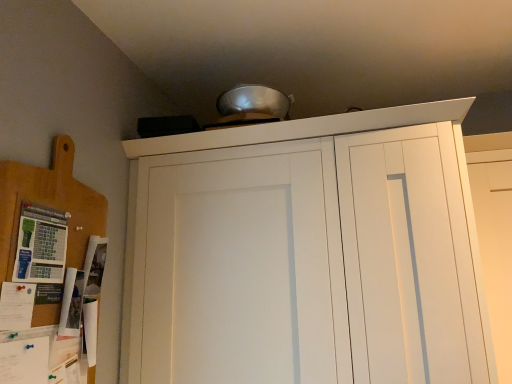
Question: Can you confirm if wooden cutting board at left is smaller than white matte door at upper center?

Choices:
 (A) yes
 (B) no

Answer: (A)

Question: Is there a large distance between wooden cutting board at left and white matte door at upper center?

Choices:
 (A) yes
 (B) no

Answer: (A)

Question: Is the position of wooden cutting board at left more distant than that of white matte door at upper center?

Choices:
 (A) no
 (B) yes

Answer: (A)

Question: From the image's perspective, is wooden cutting board at left below white matte door at upper center?

Choices:
 (A) no
 (B) yes

Answer: (A)

Question: Is wooden cutting board at left at the right side of white matte door at upper center?

Choices:
 (A) no
 (B) yes

Answer: (A)

Question: Is wooden cutting board at left wider than white matte door at upper center?

Choices:
 (A) no
 (B) yes

Answer: (A)

Question: Is white matte cupboard at upper center closer to camera compared to wooden cutting board at left?

Choices:
 (A) no
 (B) yes

Answer: (A)

Question: Is white matte cupboard at upper center facing away from wooden cutting board at left?

Choices:
 (A) no
 (B) yes

Answer: (A)

Question: From a real-world perspective, is white matte cupboard at upper center physically below wooden cutting board at left?

Choices:
 (A) no
 (B) yes

Answer: (B)

Question: Considering the relative sizes of white matte cupboard at upper center and wooden cutting board at left in the image provided, is white matte cupboard at upper center shorter than wooden cutting board at left?

Choices:
 (A) no
 (B) yes

Answer: (A)

Question: Could you tell me if white matte cupboard at upper center is turned towards wooden cutting board at left?

Choices:
 (A) yes
 (B) no

Answer: (A)

Question: Can you confirm if white matte cupboard at upper center is taller than wooden cutting board at left?

Choices:
 (A) yes
 (B) no

Answer: (A)

Question: Is white matte door at upper center completely or partially outside of wooden cutting board at left?

Choices:
 (A) yes
 (B) no

Answer: (A)